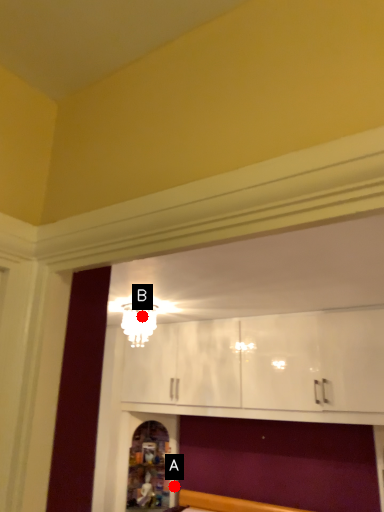
Question: Two points are circled on the image, labeled by A and B beside each circle. Which point is closer to the camera?

Choices:
 (A) A is closer
 (B) B is closer

Answer: (B)